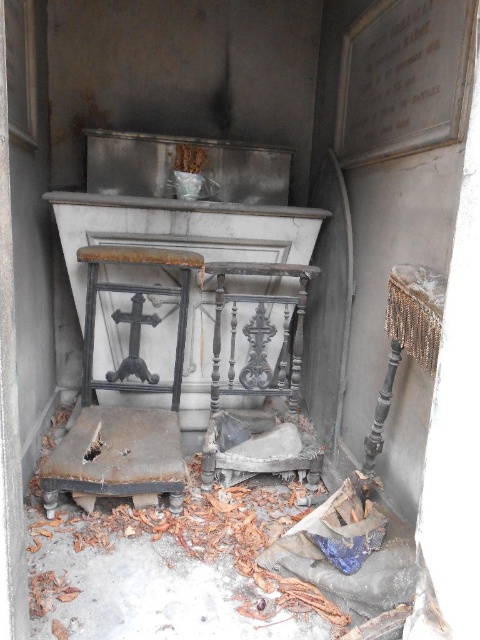
Is rusty metal table at center further to camera compared to silver metallic stool at right?

Yes, it is behind silver metallic stool at right.

Who is positioned more to the right, rusty metal table at center or silver metallic stool at right?

Positioned to the right is silver metallic stool at right.

Is point (257, 284) positioned behind point (433, 340)?

Yes.

The width and height of the screenshot is (480, 640). What are the coordinates of `rusty metal table at center` in the screenshot? It's located at (180, 230).

Who is higher up, rusty metal table at center or rusty metal stool at center?

rusty metal table at center

Is rusty metal table at center below rusty metal stool at center?

Incorrect, rusty metal table at center is not positioned below rusty metal stool at center.

Is point (85, 195) positioned in front of point (90, 344)?

Yes, it is.

At what (x,y) coordinates should I click in order to perform the action: click on rusty metal table at center. Please return your answer as a coordinate pair (x, y). Image resolution: width=480 pixels, height=640 pixels. Looking at the image, I should click on (180, 230).

Can you confirm if dark wood ornate chair at center is positioned to the right of silver metallic stool at right?

In fact, dark wood ornate chair at center is to the left of silver metallic stool at right.

Consider the image. Which is more to the left, dark wood ornate chair at center or silver metallic stool at right?

Positioned to the left is dark wood ornate chair at center.

Between point (256, 442) and point (381, 445), which one is positioned in front?

Positioned in front is point (381, 445).

At what (x,y) coordinates should I click in order to perform the action: click on dark wood ornate chair at center. Please return your answer as a coordinate pair (x, y). Looking at the image, I should click on (259, 380).